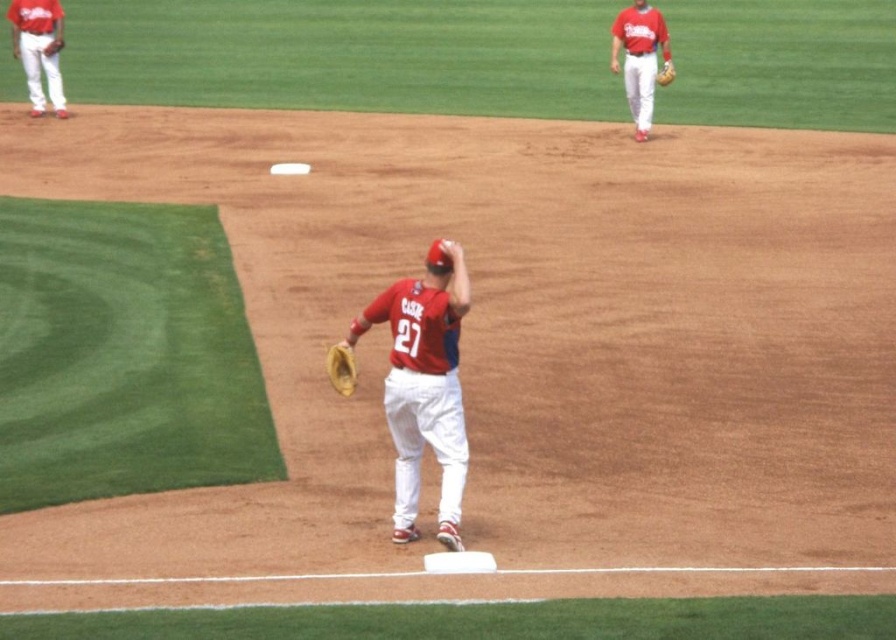
You are a baseball coach analyzing the game. You notice a point at coordinates (x=424, y=385) on the field. What object is located at this point?

The point at coordinates (x=424, y=385) corresponds to the matte red baseball glove at center.